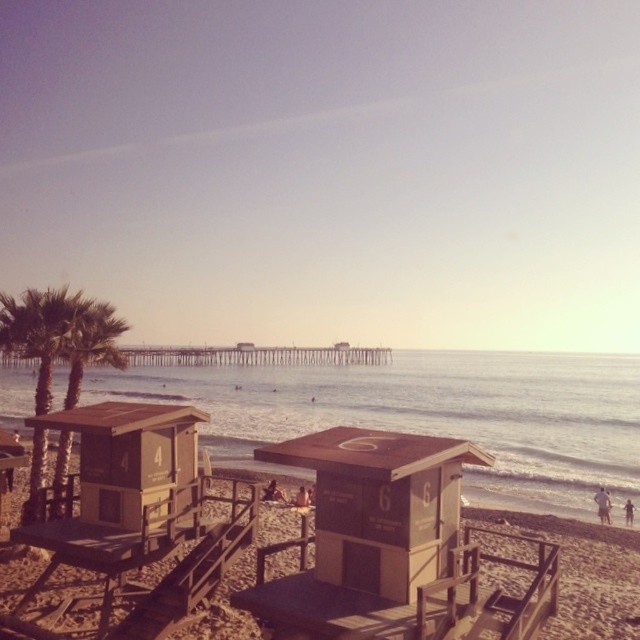
Who is positioned more to the right, brown sandy beach at center or brown wood lifeguard tower at center?

brown wood lifeguard tower at center is more to the right.

Is brown sandy beach at center shorter than brown wood lifeguard tower at center?

In fact, brown sandy beach at center may be taller than brown wood lifeguard tower at center.

Where is `brown sandy beach at center`? The image size is (640, 640). brown sandy beach at center is located at coordinates (285, 579).

Between point (218, 566) and point (172, 429), which one is positioned behind?

The point (172, 429) is behind.

This screenshot has width=640, height=640. I want to click on brown sandy beach at center, so click(285, 579).

Does wooden lifeguard tower at lower left have a smaller size compared to green leafy palm tree at left?

Yes.

Is point (97, 492) farther from viewer compared to point (40, 472)?

No, it is in front of (40, 472).

Between point (134, 433) and point (22, 355), which one is positioned behind?

Point (22, 355)

Locate an element on the screen. wooden lifeguard tower at lower left is located at coordinates (129, 456).